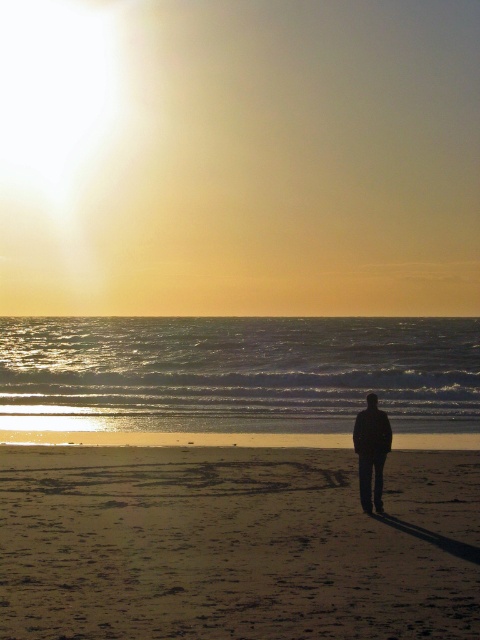
Question: Is smooth golden sand at center below black matte jacket at center?

Choices:
 (A) yes
 (B) no

Answer: (A)

Question: Among these objects, which one is nearest to the camera?

Choices:
 (A) smooth golden sand at center
 (B) black matte jacket at center

Answer: (A)

Question: Considering the relative positions of smooth golden sand at center and black matte jacket at center in the image provided, where is smooth golden sand at center located with respect to black matte jacket at center?

Choices:
 (A) below
 (B) above

Answer: (A)

Question: Where is smooth golden sand at center located in relation to black matte jacket at center in the image?

Choices:
 (A) right
 (B) left

Answer: (B)

Question: Among these objects, which one is nearest to the camera?

Choices:
 (A) smooth golden sand at center
 (B) black matte jacket at center

Answer: (A)